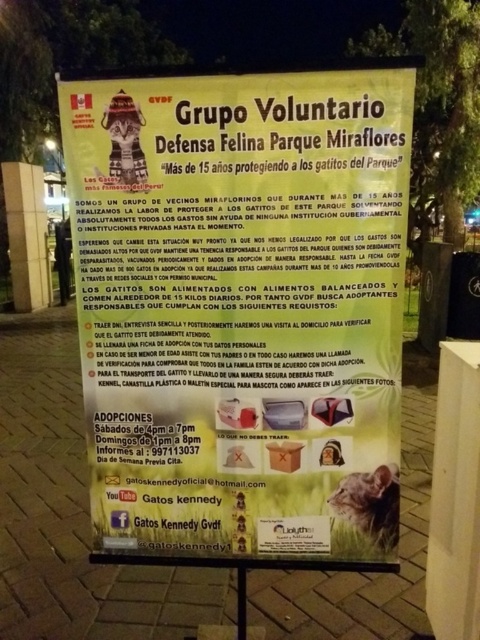
Who is more forward, (354, 93) or (363, 529)?

Point (354, 93)

Does white paper poster at center appear on the left side of fuzzy brown cat at lower right?

Indeed, white paper poster at center is positioned on the left side of fuzzy brown cat at lower right.

In order to click on white paper poster at center in this screenshot , I will do `click(238, 305)`.